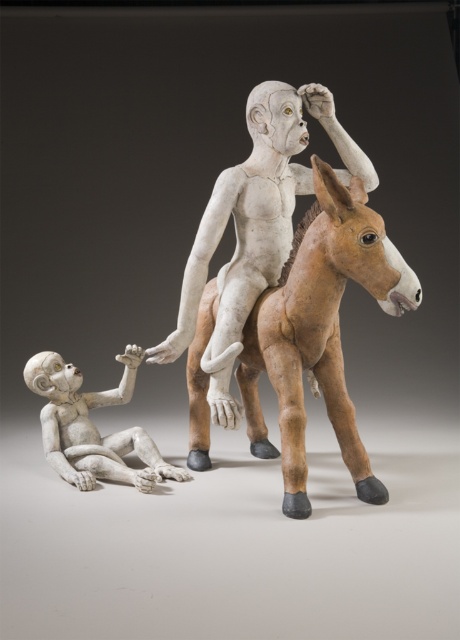
Is brown matte horse at center closer to camera compared to white matte figure at center?

Yes.

At what (x,y) coordinates should I click in order to perform the action: click on brown matte horse at center. Please return your answer as a coordinate pair (x, y). This screenshot has width=460, height=640. Looking at the image, I should click on (317, 332).

Is point (253, 324) positioned in front of point (249, 252)?

Yes.

What are the coordinates of `brown matte horse at center` in the screenshot? It's located at (317, 332).

Is white matte figure at center bigger than matte white figure at lower left?

Correct, white matte figure at center is larger in size than matte white figure at lower left.

Does white matte figure at center appear on the left side of matte white figure at lower left?

In fact, white matte figure at center is to the right of matte white figure at lower left.

What do you see at coordinates (254, 227) in the screenshot? The image size is (460, 640). I see `white matte figure at center` at bounding box center [254, 227].

This screenshot has width=460, height=640. I want to click on white matte figure at center, so click(x=254, y=227).

Does point (285, 403) come farther from viewer compared to point (92, 400)?

That is False.

Where is `brown matte horse at center`? The width and height of the screenshot is (460, 640). brown matte horse at center is located at coordinates (317, 332).